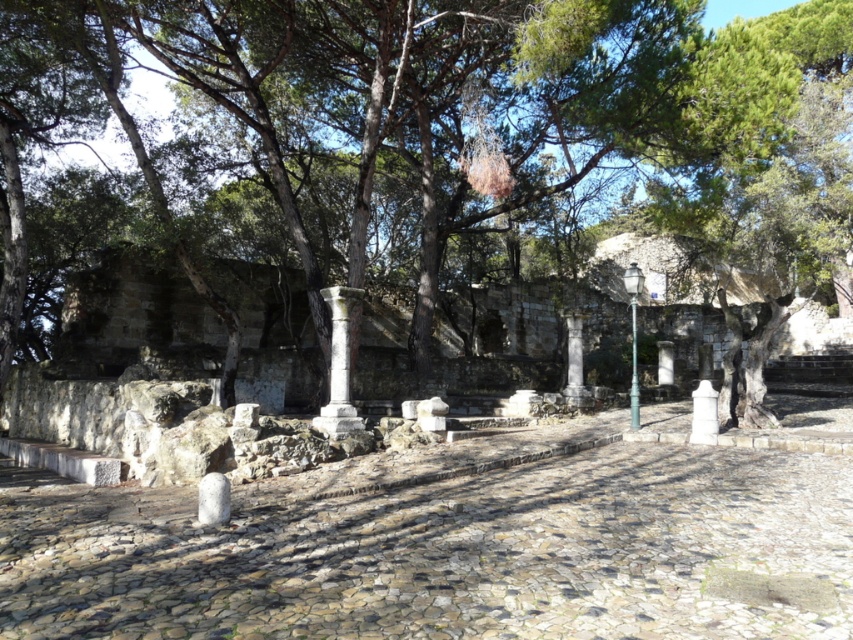
Question: Does white stone column at center have a smaller size compared to white stone pillar at center?

Choices:
 (A) yes
 (B) no

Answer: (B)

Question: Can you confirm if white stone column at center is positioned to the right of white stone pillar at center?

Choices:
 (A) yes
 (B) no

Answer: (B)

Question: Is smooth stone column at center closer to the viewer compared to white stone pillar at center?

Choices:
 (A) yes
 (B) no

Answer: (B)

Question: Which point is closer to the camera taking this photo?

Choices:
 (A) (575, 316)
 (B) (706, 387)
 (C) (276, 10)

Answer: (B)

Question: Estimate the real-world distances between objects in this image. Which object is farther from the green leafy tree at center?

Choices:
 (A) white stone column at center
 (B) white stone pillar at center
 (C) smooth stone column at center

Answer: (B)

Question: Which object is farther from the camera taking this photo?

Choices:
 (A) white stone column at center
 (B) white stone pillar at center
 (C) smooth stone column at center

Answer: (C)